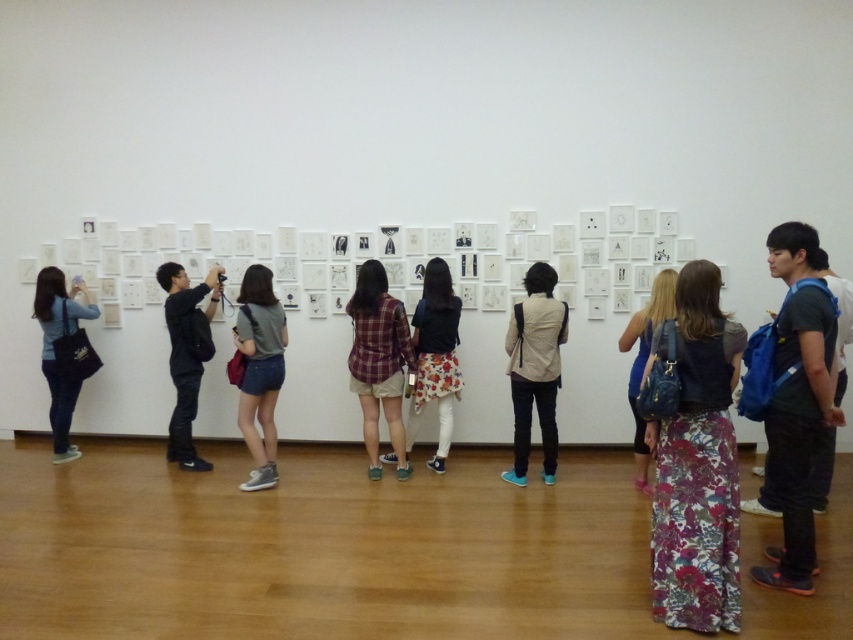
Question: Which of the following is the farthest from the observer?

Choices:
 (A) (256, 470)
 (B) (407, 417)

Answer: (B)

Question: Among these objects, which one is farthest from the camera?

Choices:
 (A) beige fabric jacket at center
 (B) floral fabric dress at center

Answer: (A)

Question: Estimate the real-world distances between objects in this image. Which object is farther from the floral fabric skirt at center?

Choices:
 (A) beige fabric jacket at center
 (B) floral fabric dress at center
 (C) denim shorts at center

Answer: (B)

Question: Considering the relative positions of floral fabric dress at center and black matte jacket at center in the image provided, where is floral fabric dress at center located with respect to black matte jacket at center?

Choices:
 (A) left
 (B) right

Answer: (B)

Question: Considering the relative positions of beige fabric jacket at center and denim shorts at center in the image provided, where is beige fabric jacket at center located with respect to denim shorts at center?

Choices:
 (A) above
 (B) below

Answer: (B)

Question: Is the position of beige fabric jacket at center less distant than that of denim shorts at center?

Choices:
 (A) no
 (B) yes

Answer: (B)